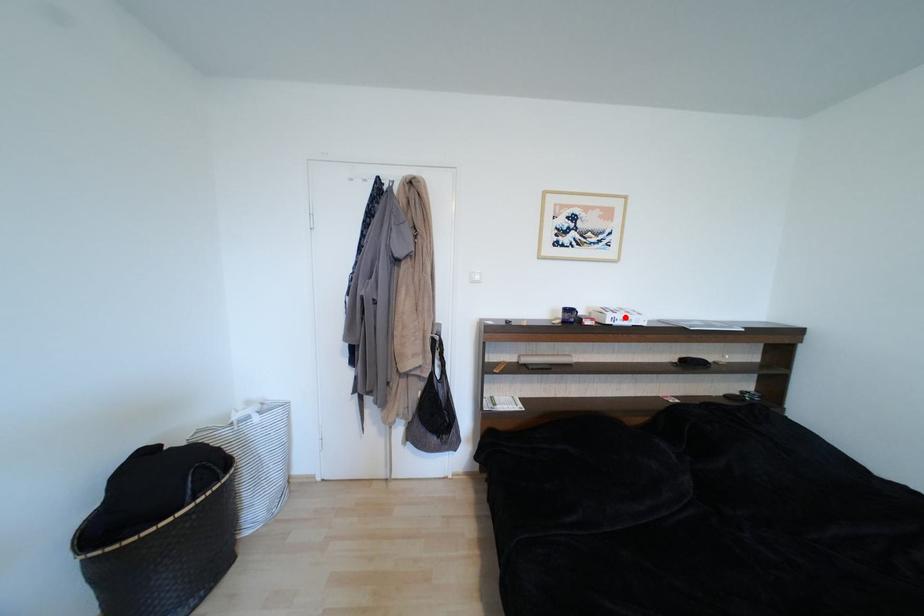
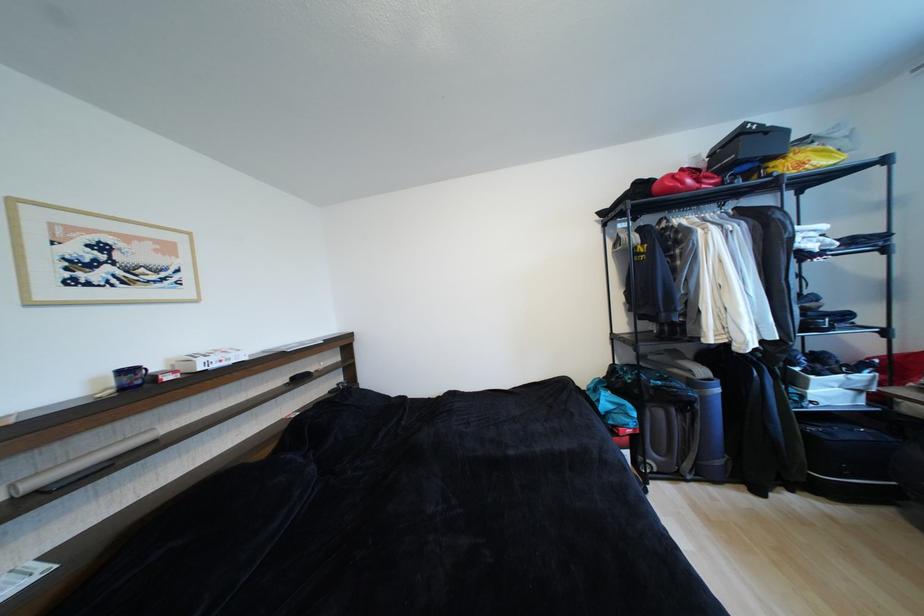
Question: I am providing you with two images of the same scene from different viewpoints. A red point is marked on the first image. Can you still see the location of the red point in image 2?

Choices:
 (A) Yes
 (B) No

Answer: (A)